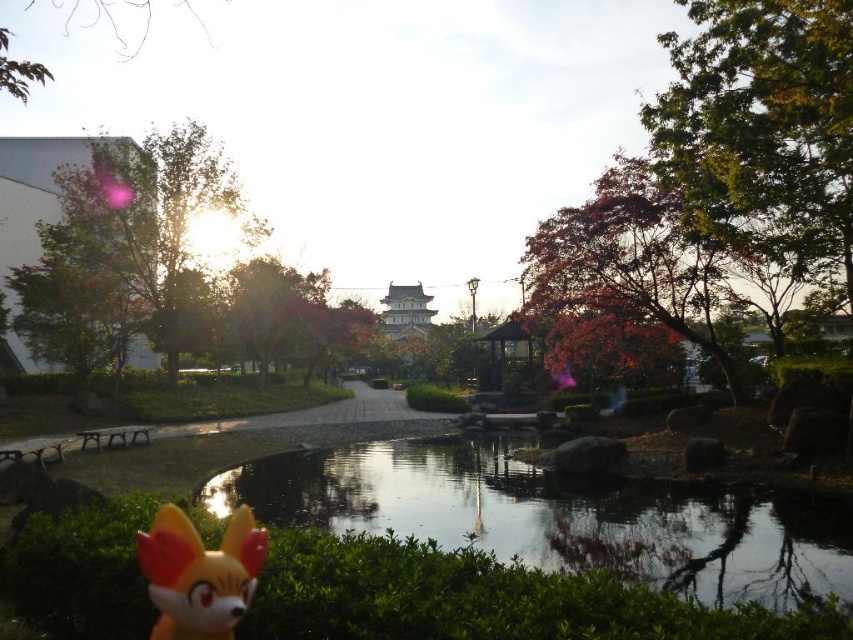
Who is shorter, transparent glass water at center or matte orange plush toy at lower left?

With less height is matte orange plush toy at lower left.

Where is `transparent glass water at center`? transparent glass water at center is located at coordinates (556, 516).

Who is more distant from viewer, (596, 486) or (149, 552)?

Positioned behind is point (596, 486).

Locate an element on the screen. The width and height of the screenshot is (853, 640). transparent glass water at center is located at coordinates (556, 516).